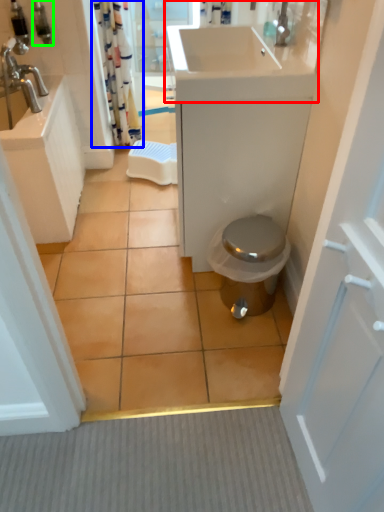
Question: Which object is positioned closest to sink (highlighted by a red box)? Select from shower curtain (highlighted by a blue box) and toiletry (highlighted by a green box).

Choices:
 (A) shower curtain
 (B) toiletry

Answer: (A)